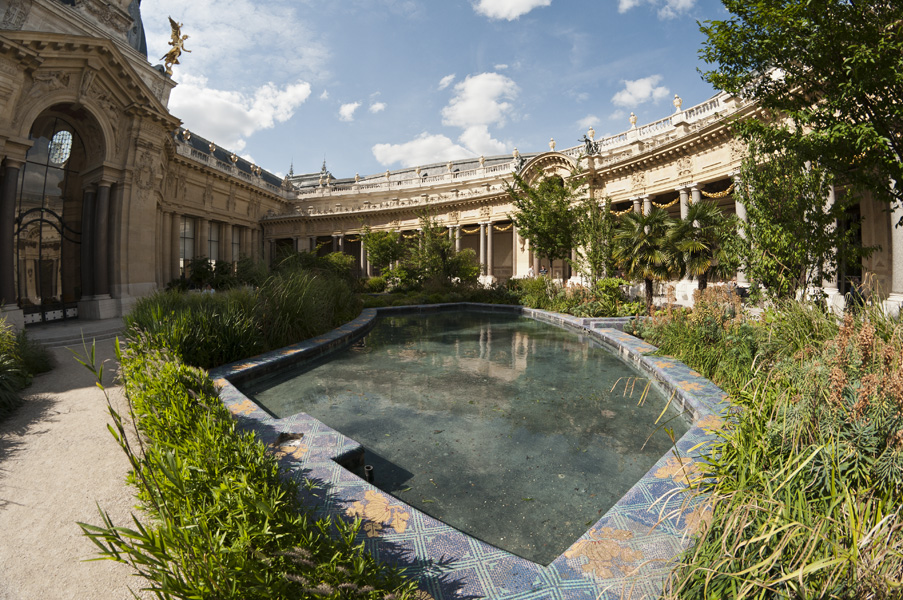
I want to click on window, so click(191, 238), click(212, 248), click(236, 248).